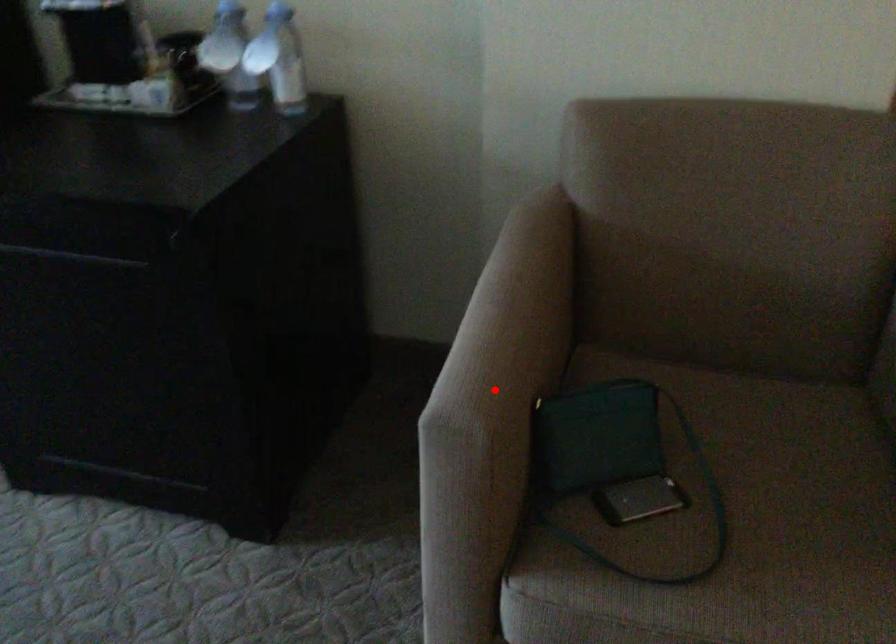
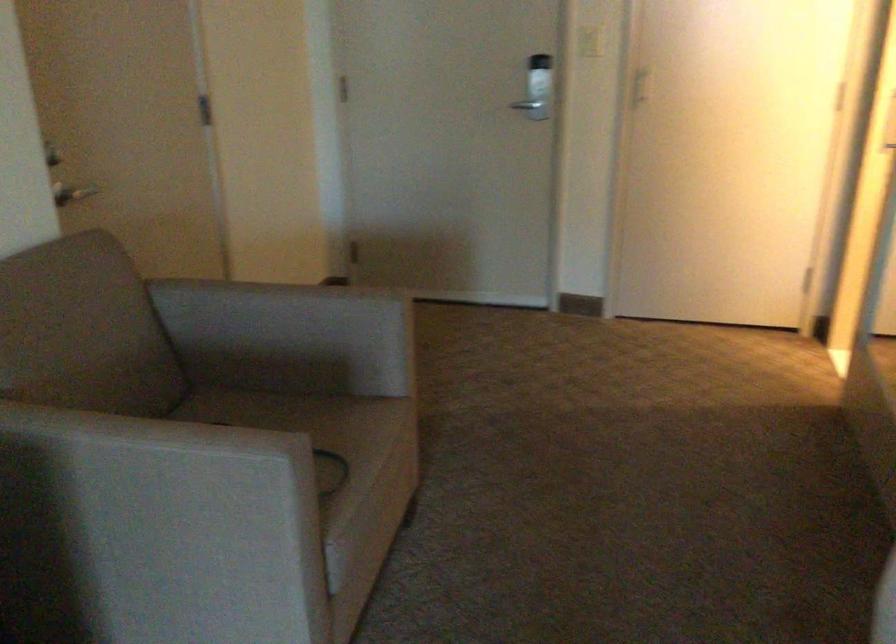
Question: I am providing you with two images of the same scene from different viewpoints. Image1 has a red point marked. In image2, the corresponding 3D location appears at what relative position? Reply with the corresponding letter.

Choices:
 (A) Closer
 (B) Farther

Answer: (B)